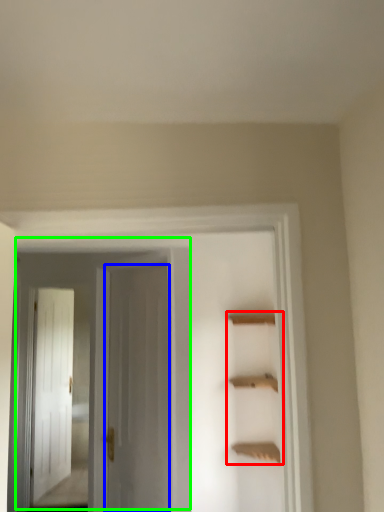
Question: Considering the real-world distances, which object is closest to cabinet (highlighted by a red box)? door (highlighted by a blue box) or door (highlighted by a green box).

Choices:
 (A) door
 (B) door

Answer: (B)